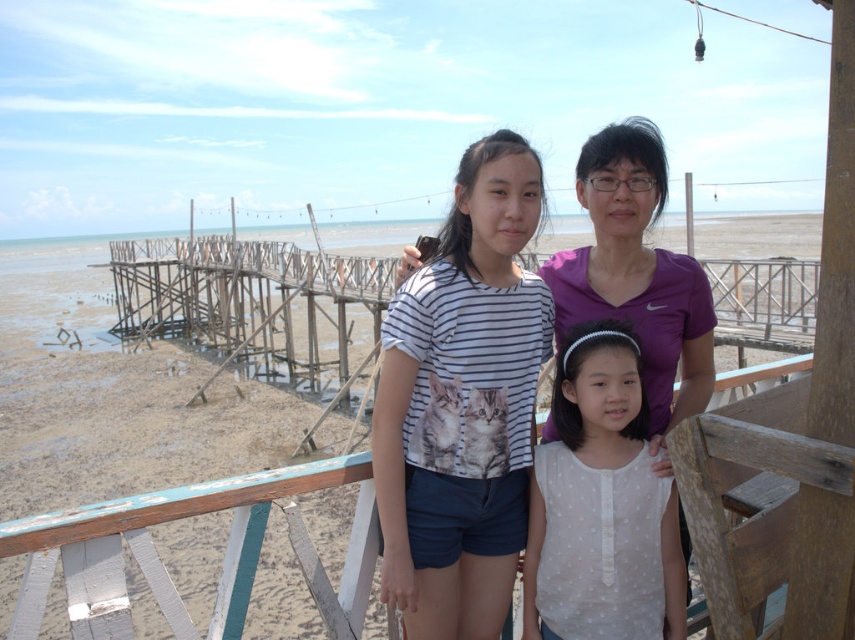
Which is behind, point (410, 460) or point (688, 292)?

The point (688, 292) is more distant.

Is white striped shirt at center smaller than purple matte shirt at center?

Yes, white striped shirt at center is smaller than purple matte shirt at center.

Is point (464, 448) positioned after point (664, 348)?

No, (464, 448) is in front of (664, 348).

At what (x,y) coordinates should I click in order to perform the action: click on white striped shirt at center. Please return your answer as a coordinate pair (x, y). This screenshot has width=855, height=640. Looking at the image, I should click on (463, 403).

Between wooden pier at center and white striped shirt at center, which one is positioned higher?

wooden pier at center is above.

Looking at this image, is wooden pier at center closer to camera compared to white striped shirt at center?

Yes.

Identify the location of wooden pier at center. This screenshot has height=640, width=855. (107, 394).

Locate an element on the screen. Image resolution: width=855 pixels, height=640 pixels. white striped shirt at center is located at coordinates (463, 403).

Who is lower down, white striped shirt at center or white dotted blouse at center?

Positioned lower is white dotted blouse at center.

Find the location of `white striped shirt at center`. white striped shirt at center is located at coordinates (463, 403).